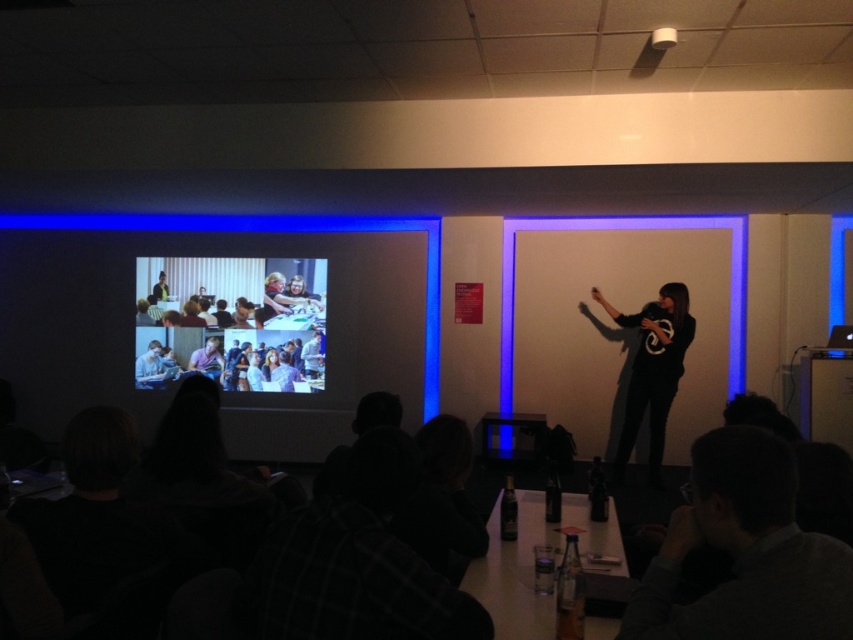
Describe the element at coordinates (614, 323) in the screenshot. The image size is (853, 640). I see `whiteboard at center` at that location.

This screenshot has width=853, height=640. I want to click on whiteboard at center, so click(614, 323).

Looking at this image, is gray sweater at lower right wider than matte plastic projector screen at center?

In fact, gray sweater at lower right might be narrower than matte plastic projector screen at center.

Which of these two, gray sweater at lower right or matte plastic projector screen at center, stands taller?

Standing taller between the two is matte plastic projector screen at center.

Between point (741, 630) and point (207, 323), which one is positioned in front?

Point (741, 630) is in front.

The height and width of the screenshot is (640, 853). I want to click on gray sweater at lower right, so click(746, 552).

Is gray sweater at lower right positioned at the back of black matte shirt at center?

No, it is in front of black matte shirt at center.

Can you confirm if gray sweater at lower right is thinner than black matte shirt at center?

Correct, gray sweater at lower right's width is less than black matte shirt at center's.

Is point (757, 596) positioned after point (651, 440)?

No, it is in front of (651, 440).

Find the location of a particular element. The image size is (853, 640). gray sweater at lower right is located at coordinates (746, 552).